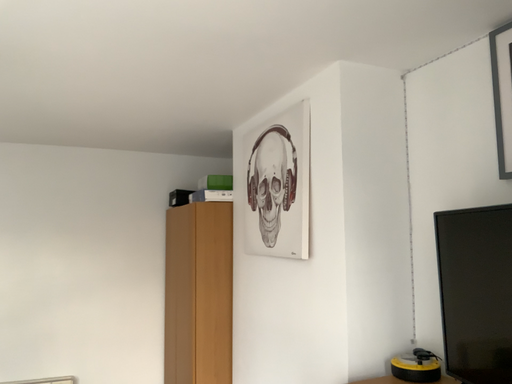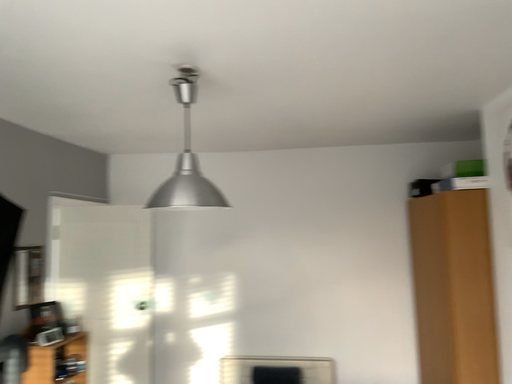
Question: Which way did the camera rotate in the video?

Choices:
 (A) rotated left
 (B) rotated right

Answer: (A)